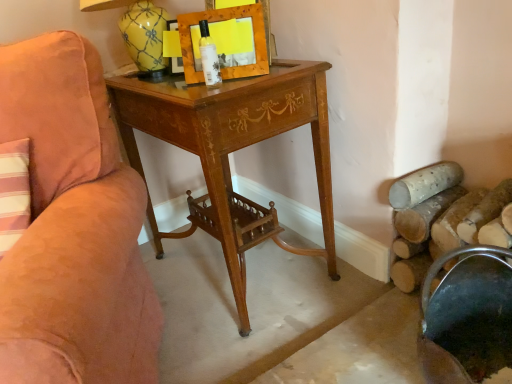
I want to click on vacant space to the left of wooden picture frame at upper center, so click(x=170, y=85).